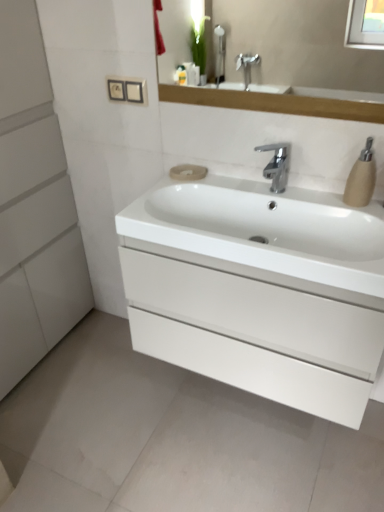
Question: Can you confirm if polished chrome faucet at center is bigger than white glossy sink at center?

Choices:
 (A) no
 (B) yes

Answer: (A)

Question: Is polished chrome faucet at center in contact with white glossy sink at center?

Choices:
 (A) yes
 (B) no

Answer: (B)

Question: Is polished chrome faucet at center outside white glossy sink at center?

Choices:
 (A) no
 (B) yes

Answer: (B)

Question: Is polished chrome faucet at center oriented towards white glossy sink at center?

Choices:
 (A) no
 (B) yes

Answer: (A)

Question: Is the depth of polished chrome faucet at center less than that of white glossy sink at center?

Choices:
 (A) no
 (B) yes

Answer: (A)

Question: Does polished chrome faucet at center have a smaller size compared to white glossy sink at center?

Choices:
 (A) no
 (B) yes

Answer: (B)

Question: Is beige matte soap dispenser at right completely or partially inside white glossy sink at center?

Choices:
 (A) no
 (B) yes

Answer: (A)

Question: Can you confirm if white glossy sink at center is positioned to the right of beige matte soap dispenser at right?

Choices:
 (A) no
 (B) yes

Answer: (A)

Question: Is the depth of white glossy sink at center greater than that of beige matte soap dispenser at right?

Choices:
 (A) yes
 (B) no

Answer: (B)

Question: Is white glossy sink at center outside of beige matte soap dispenser at right?

Choices:
 (A) yes
 (B) no

Answer: (A)

Question: Is white glossy sink at center looking in the opposite direction of beige matte soap dispenser at right?

Choices:
 (A) yes
 (B) no

Answer: (B)

Question: Does white glossy sink at center come in front of beige matte soap dispenser at right?

Choices:
 (A) no
 (B) yes

Answer: (B)

Question: Does beige matte soap at center have a greater width compared to white glossy sink at center?

Choices:
 (A) yes
 (B) no

Answer: (B)